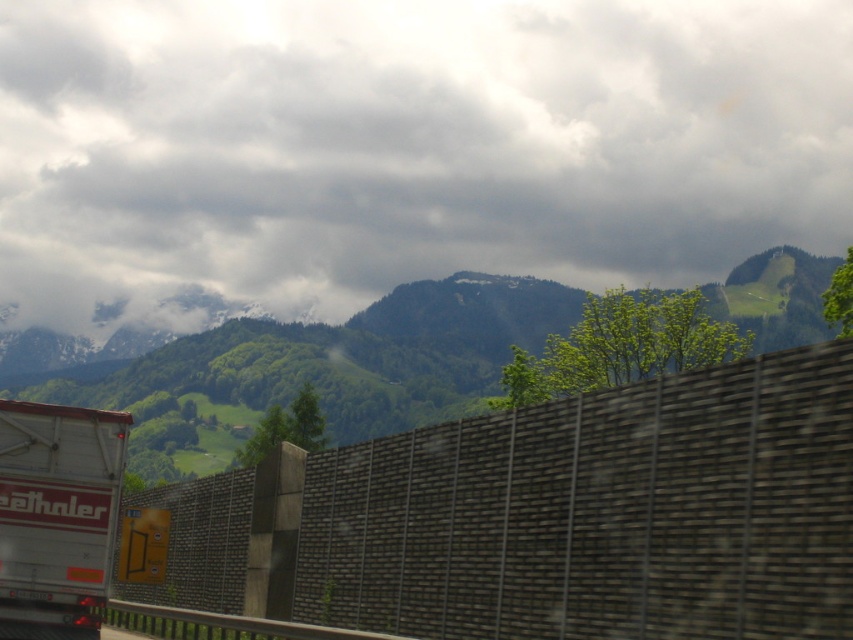
Question: Is cloudy sky at upper center above green grassy mountain at center?

Choices:
 (A) yes
 (B) no

Answer: (A)

Question: Among these objects, which one is farthest from the camera?

Choices:
 (A) cloudy sky at upper center
 (B) green grassy mountain at center
 (C) white matte trailer truck at left
 (D) dark gray concrete wall at center

Answer: (A)

Question: Is dark gray concrete wall at center smaller than green grassy mountain at center?

Choices:
 (A) no
 (B) yes

Answer: (B)

Question: Is dark gray concrete wall at center bigger than white matte trailer truck at left?

Choices:
 (A) yes
 (B) no

Answer: (A)

Question: Which of the following is the closest to the observer?

Choices:
 (A) (107, 433)
 (B) (196, 339)

Answer: (A)

Question: Which of the following is the farthest from the observer?

Choices:
 (A) white matte trailer truck at left
 (B) dark gray concrete wall at center
 (C) green grassy mountain at center
 (D) cloudy sky at upper center

Answer: (D)